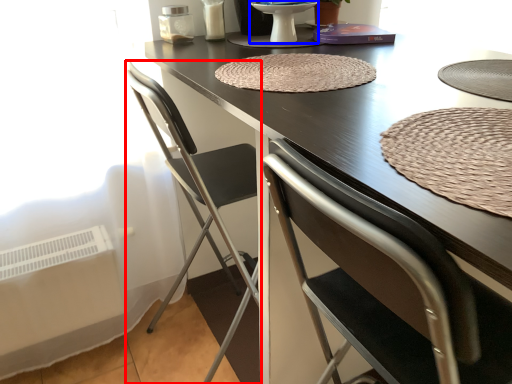
Question: Which point is closer to the camera, chair (highlighted by a red box) or round table (highlighted by a blue box)?

Choices:
 (A) chair
 (B) round table

Answer: (A)